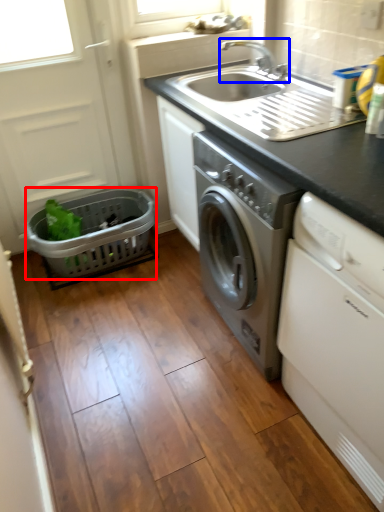
Question: Which point is further to the camera, basket (highlighted by a red box) or tap (highlighted by a blue box)?

Choices:
 (A) basket
 (B) tap

Answer: (A)